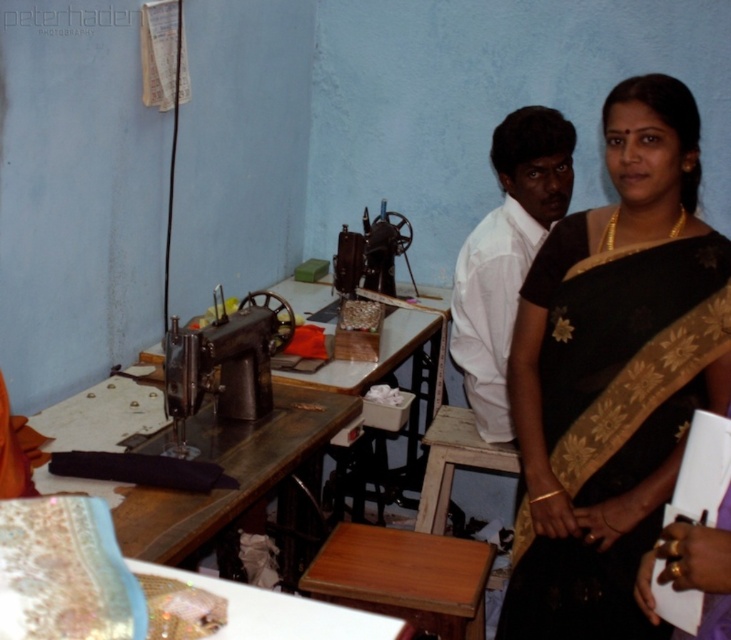
Question: Which of the following is the farthest from the observer?

Choices:
 (A) metallic sewing machine at center
 (B) wooden table at center

Answer: (A)

Question: Which object is farther from the camera taking this photo?

Choices:
 (A) wooden table at center
 (B) metallic sewing machine at center

Answer: (B)

Question: Which point is farther from the camera taking this photo?

Choices:
 (A) (170, 518)
 (B) (227, 408)
 (C) (523, 364)

Answer: (B)

Question: Is wooden table at center behind metallic sewing machine at center?

Choices:
 (A) yes
 (B) no

Answer: (B)

Question: Is wooden table at center smaller than metallic sewing machine at center?

Choices:
 (A) yes
 (B) no

Answer: (B)

Question: Is black silk saree at right below metallic sewing machine at center?

Choices:
 (A) no
 (B) yes

Answer: (B)